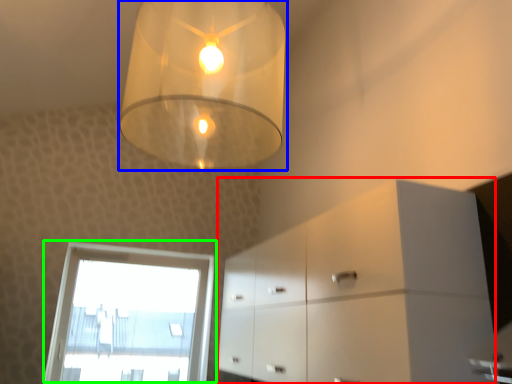
Question: Based on their relative distances, which object is nearer to dresser (highlighted by a red box)? Choose from lamp (highlighted by a blue box) and window (highlighted by a green box).

Choices:
 (A) lamp
 (B) window

Answer: (A)